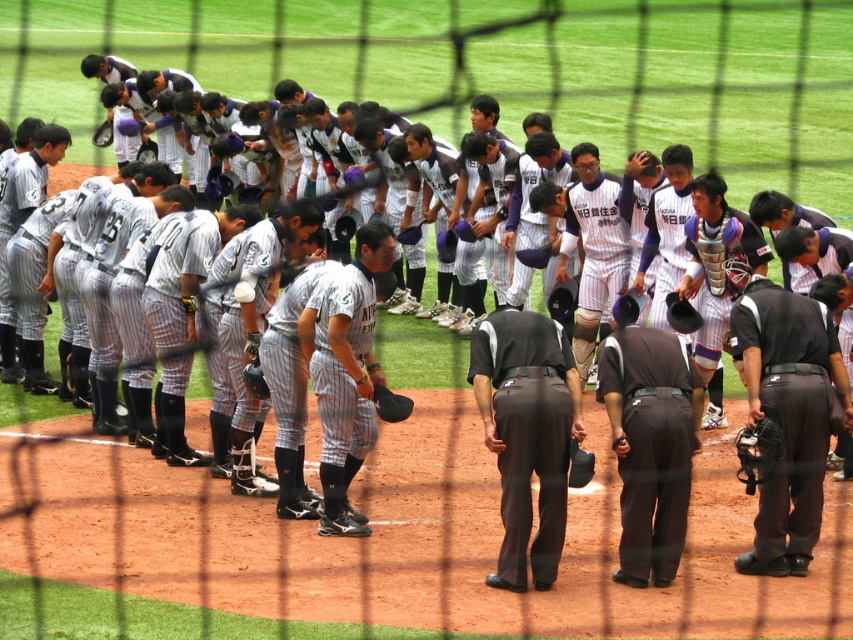
Can you confirm if black matte uniform at center is positioned to the right of black leather baseball glove at center?

Yes, black matte uniform at center is to the right of black leather baseball glove at center.

Does point (753, 388) come in front of point (387, 390)?

Yes, point (753, 388) is in front of point (387, 390).

Does point (822, 435) come closer to viewer compared to point (390, 417)?

Yes, point (822, 435) is in front of point (390, 417).

You are a GUI agent. You are given a task and a screenshot of the screen. Output one action in this format:
    pyautogui.click(x=<x>, y=<y>)
    Task: Click on the black matte uniform at center
    
    Given the screenshot: What is the action you would take?
    pyautogui.click(x=788, y=417)

From the picture: Is the position of dark brown uniform at center less distant than that of striped fabric baseball uniform at center?

Yes, dark brown uniform at center is in front of striped fabric baseball uniform at center.

Can you confirm if dark brown uniform at center is positioned to the left of striped fabric baseball uniform at center?

In fact, dark brown uniform at center is to the right of striped fabric baseball uniform at center.

Between point (643, 529) and point (271, 490), which one is positioned in front?

Point (643, 529) is in front.

Find the location of `dark brown uniform at center`. dark brown uniform at center is located at coordinates (648, 442).

Is the position of black matte uniform at center less distant than that of striped fabric baseball uniform at center?

Yes.

This screenshot has height=640, width=853. Find the location of `black matte uniform at center`. black matte uniform at center is located at coordinates (788, 417).

Locate an element on the screen. black matte uniform at center is located at coordinates (788, 417).